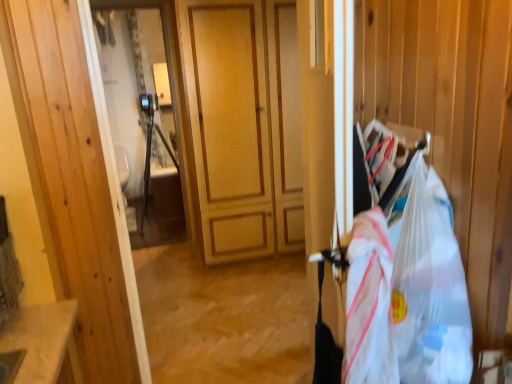
This screenshot has height=384, width=512. What are the coordinates of `white plastic bag at right, the 2th grocery bag in the right-to-left sequence` in the screenshot? It's located at (369, 304).

Describe the element at coordinates (369, 304) in the screenshot. The image size is (512, 384). I see `white plastic bag at right, the 2th grocery bag in the right-to-left sequence` at that location.

Locate an element on the screen. clear plastic grocery bag at right, arranged as the 2th grocery bag when viewed from the left is located at coordinates (408, 287).

Image resolution: width=512 pixels, height=384 pixels. Describe the element at coordinates (408, 287) in the screenshot. I see `clear plastic grocery bag at right, arranged as the 2th grocery bag when viewed from the left` at that location.

Where is `white plastic bag at right, the 2th grocery bag in the right-to-left sequence`? This screenshot has height=384, width=512. white plastic bag at right, the 2th grocery bag in the right-to-left sequence is located at coordinates (369, 304).

Which is more to the left, clear plastic grocery bag at right, the first grocery bag from the right, or white plastic bag at right, the 2th grocery bag in the right-to-left sequence?

white plastic bag at right, the 2th grocery bag in the right-to-left sequence.

Does clear plastic grocery bag at right, the first grocery bag from the right, lie behind white plastic bag at right, which is counted as the 1th grocery bag, starting from the left?

No, clear plastic grocery bag at right, the first grocery bag from the right, is closer to the camera.

Is point (439, 347) more distant than point (352, 247)?

No.

Based on the photo, from the image's perspective, is clear plastic grocery bag at right, arranged as the 2th grocery bag when viewed from the left, located above or below white plastic bag at right, the 2th grocery bag in the right-to-left sequence?

clear plastic grocery bag at right, arranged as the 2th grocery bag when viewed from the left, is above white plastic bag at right, the 2th grocery bag in the right-to-left sequence.

From a real-world perspective, between clear plastic grocery bag at right, arranged as the 2th grocery bag when viewed from the left, and white plastic bag at right, the 2th grocery bag in the right-to-left sequence, who is vertically higher?

In real-world perspective, clear plastic grocery bag at right, arranged as the 2th grocery bag when viewed from the left, is above.

Between clear plastic grocery bag at right, the first grocery bag from the right, and white plastic bag at right, the 2th grocery bag in the right-to-left sequence, which one has smaller width?

white plastic bag at right, the 2th grocery bag in the right-to-left sequence.

Is clear plastic grocery bag at right, arranged as the 2th grocery bag when viewed from the left, taller than white plastic bag at right, which is counted as the 1th grocery bag, starting from the left?

Indeed, clear plastic grocery bag at right, arranged as the 2th grocery bag when viewed from the left, has a greater height compared to white plastic bag at right, which is counted as the 1th grocery bag, starting from the left.

Who is smaller, clear plastic grocery bag at right, arranged as the 2th grocery bag when viewed from the left, or white plastic bag at right, which is counted as the 1th grocery bag, starting from the left?

white plastic bag at right, which is counted as the 1th grocery bag, starting from the left, is smaller.

Is clear plastic grocery bag at right, the first grocery bag from the right, not within white plastic bag at right, which is counted as the 1th grocery bag, starting from the left?

Yes.

Are clear plastic grocery bag at right, arranged as the 2th grocery bag when viewed from the left, and white plastic bag at right, the 2th grocery bag in the right-to-left sequence, far apart?

They are positioned close to each other.

Is clear plastic grocery bag at right, arranged as the 2th grocery bag when viewed from the left, positioned with its back to white plastic bag at right, the 2th grocery bag in the right-to-left sequence?

Yes, white plastic bag at right, the 2th grocery bag in the right-to-left sequence, is at the back of clear plastic grocery bag at right, arranged as the 2th grocery bag when viewed from the left.

Could you measure the distance between clear plastic grocery bag at right, the first grocery bag from the right, and white plastic bag at right, the 2th grocery bag in the right-to-left sequence?

They are 1.64 inches apart.

Locate an element on the screen. The height and width of the screenshot is (384, 512). grocery bag that is above the white plastic bag at right, the 2th grocery bag in the right-to-left sequence (from the image's perspective) is located at coordinates (408, 287).

Does white plastic bag at right, the 2th grocery bag in the right-to-left sequence, appear on the left side of clear plastic grocery bag at right, arranged as the 2th grocery bag when viewed from the left?

Correct, you'll find white plastic bag at right, the 2th grocery bag in the right-to-left sequence, to the left of clear plastic grocery bag at right, arranged as the 2th grocery bag when viewed from the left.

Considering the positions of objects white plastic bag at right, which is counted as the 1th grocery bag, starting from the left, and clear plastic grocery bag at right, arranged as the 2th grocery bag when viewed from the left, in the image provided, who is in front, white plastic bag at right, which is counted as the 1th grocery bag, starting from the left, or clear plastic grocery bag at right, arranged as the 2th grocery bag when viewed from the left,?

clear plastic grocery bag at right, arranged as the 2th grocery bag when viewed from the left, is more forward.

Which is in front, point (383, 373) or point (422, 159)?

The point (383, 373) is in front.

Looking at this image, from the image's perspective, which object appears higher, white plastic bag at right, which is counted as the 1th grocery bag, starting from the left, or clear plastic grocery bag at right, arranged as the 2th grocery bag when viewed from the left?

From the image's view, clear plastic grocery bag at right, arranged as the 2th grocery bag when viewed from the left, is above.

From a real-world perspective, is white plastic bag at right, which is counted as the 1th grocery bag, starting from the left, over clear plastic grocery bag at right, the first grocery bag from the right?

No, from a real-world perspective, white plastic bag at right, which is counted as the 1th grocery bag, starting from the left, is not above clear plastic grocery bag at right, the first grocery bag from the right.

Looking at their sizes, would you say white plastic bag at right, the 2th grocery bag in the right-to-left sequence, is wider or thinner than clear plastic grocery bag at right, the first grocery bag from the right?

Considering their sizes, white plastic bag at right, the 2th grocery bag in the right-to-left sequence, looks slimmer than clear plastic grocery bag at right, the first grocery bag from the right.

In terms of height, does white plastic bag at right, which is counted as the 1th grocery bag, starting from the left, look taller or shorter compared to clear plastic grocery bag at right, the first grocery bag from the right?

Considering their sizes, white plastic bag at right, which is counted as the 1th grocery bag, starting from the left, has less height than clear plastic grocery bag at right, the first grocery bag from the right.

Who is bigger, white plastic bag at right, which is counted as the 1th grocery bag, starting from the left, or clear plastic grocery bag at right, arranged as the 2th grocery bag when viewed from the left?

clear plastic grocery bag at right, arranged as the 2th grocery bag when viewed from the left, is bigger.

Could clear plastic grocery bag at right, arranged as the 2th grocery bag when viewed from the left, be considered to be inside white plastic bag at right, the 2th grocery bag in the right-to-left sequence?

No, white plastic bag at right, the 2th grocery bag in the right-to-left sequence, does not contain clear plastic grocery bag at right, arranged as the 2th grocery bag when viewed from the left.

Is the surface of white plastic bag at right, the 2th grocery bag in the right-to-left sequence, in direct contact with clear plastic grocery bag at right, the first grocery bag from the right?

Yes, white plastic bag at right, the 2th grocery bag in the right-to-left sequence, is with clear plastic grocery bag at right, the first grocery bag from the right.

Is white plastic bag at right, which is counted as the 1th grocery bag, starting from the left, looking in the opposite direction of clear plastic grocery bag at right, the first grocery bag from the right?

No, clear plastic grocery bag at right, the first grocery bag from the right, is not at the back of white plastic bag at right, which is counted as the 1th grocery bag, starting from the left.

Can you tell me how much white plastic bag at right, the 2th grocery bag in the right-to-left sequence, and clear plastic grocery bag at right, arranged as the 2th grocery bag when viewed from the left, differ in facing direction?

There is a 79.9-degree angle between the facing directions of white plastic bag at right, the 2th grocery bag in the right-to-left sequence, and clear plastic grocery bag at right, arranged as the 2th grocery bag when viewed from the left.

What are the coordinates of `grocery bag above the white plastic bag at right, which is counted as the 1th grocery bag, starting from the left (from a real-world perspective)` in the screenshot? It's located at (408, 287).

Where is `grocery bag that is behind the clear plastic grocery bag at right, arranged as the 2th grocery bag when viewed from the left`? grocery bag that is behind the clear plastic grocery bag at right, arranged as the 2th grocery bag when viewed from the left is located at coordinates (369, 304).

Where is `grocery bag below the clear plastic grocery bag at right, arranged as the 2th grocery bag when viewed from the left (from the image's perspective)`? grocery bag below the clear plastic grocery bag at right, arranged as the 2th grocery bag when viewed from the left (from the image's perspective) is located at coordinates (369, 304).